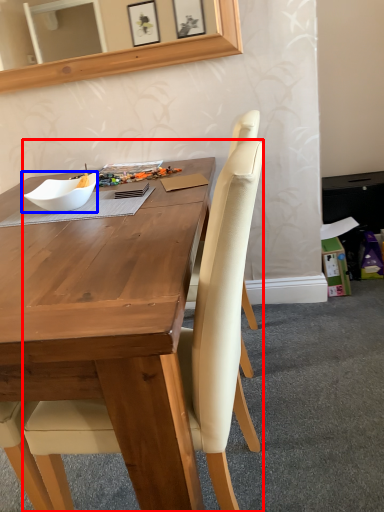
Question: Among these objects, which one is nearest to the camera, chair (highlighted by a red box) or bowl (highlighted by a blue box)?

Choices:
 (A) chair
 (B) bowl

Answer: (A)